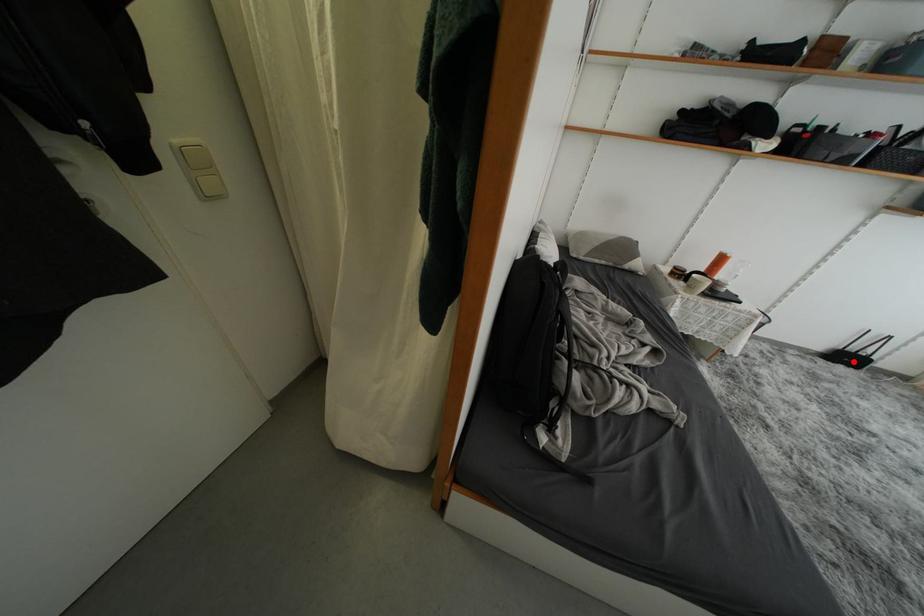
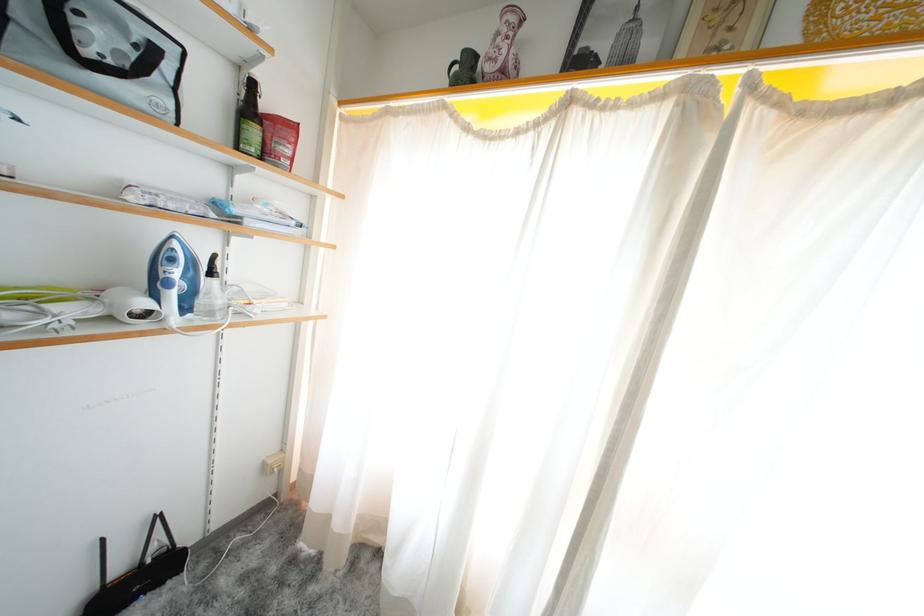
The point at the highlighted location is marked in the first image. Where is the corresponding point in the second image?

(143, 586)